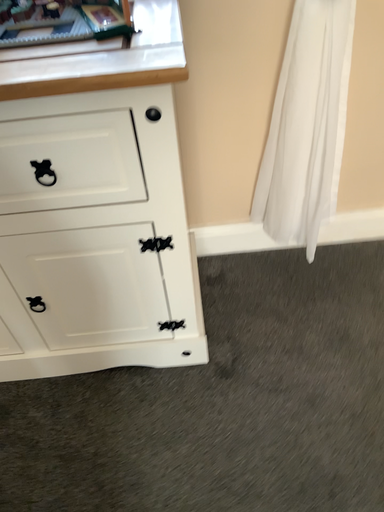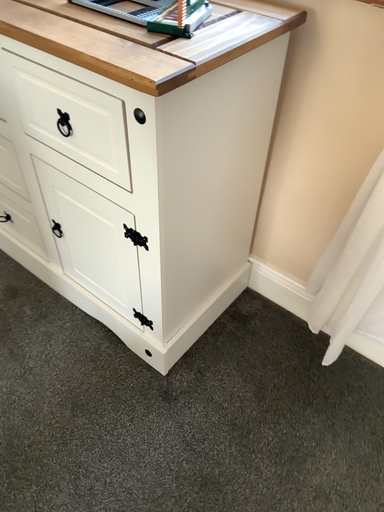
Question: Which way did the camera rotate in the video?

Choices:
 (A) rotated left
 (B) rotated right

Answer: (A)